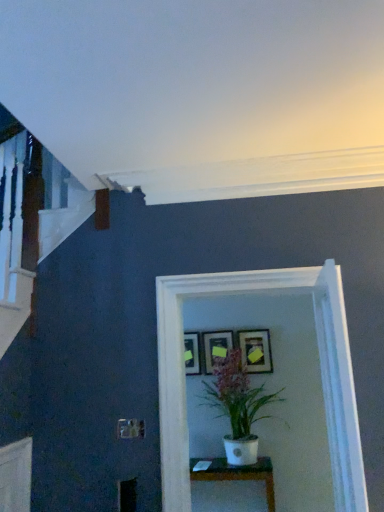
Question: Is there a large distance between white matte pot at center and matte black picture frame at center, the second picture frame when ordered from left to right?

Choices:
 (A) no
 (B) yes

Answer: (A)

Question: Can you confirm if white matte pot at center is smaller than matte black picture frame at center, the second picture frame when ordered from left to right?

Choices:
 (A) no
 (B) yes

Answer: (A)

Question: Is white matte pot at center closer to camera compared to matte black picture frame at center, which is counted as the second picture frame, starting from the right?

Choices:
 (A) yes
 (B) no

Answer: (A)

Question: Does white matte pot at center have a larger size compared to matte black picture frame at center, which is counted as the second picture frame, starting from the right?

Choices:
 (A) no
 (B) yes

Answer: (B)

Question: Are white matte pot at center and matte black picture frame at center, which is counted as the second picture frame, starting from the right, making contact?

Choices:
 (A) yes
 (B) no

Answer: (B)

Question: Is white matte pot at center located outside matte black picture frame at center, which is counted as the second picture frame, starting from the right?

Choices:
 (A) no
 (B) yes

Answer: (B)

Question: From a real-world perspective, is matte black picture frame at center, the second picture frame when ordered from left to right, located beneath matte black picture frame at center, placed as the 3th picture frame when sorted from right to left?

Choices:
 (A) yes
 (B) no

Answer: (B)

Question: Is matte black picture frame at center, the second picture frame when ordered from left to right, far away from matte black picture frame at center, placed as the 3th picture frame when sorted from right to left?

Choices:
 (A) yes
 (B) no

Answer: (B)

Question: Is matte black picture frame at center, which is counted as the second picture frame, starting from the right, in contact with matte black picture frame at center, the 1th picture frame viewed from the left?

Choices:
 (A) yes
 (B) no

Answer: (B)

Question: Considering the relative positions of matte black picture frame at center, which is counted as the second picture frame, starting from the right, and matte black picture frame at center, the 1th picture frame viewed from the left, in the image provided, is matte black picture frame at center, which is counted as the second picture frame, starting from the right, in front of matte black picture frame at center, the 1th picture frame viewed from the left,?

Choices:
 (A) no
 (B) yes

Answer: (B)

Question: Is matte black picture frame at center, which is counted as the second picture frame, starting from the right, smaller than matte black picture frame at center, the 1th picture frame viewed from the left?

Choices:
 (A) yes
 (B) no

Answer: (B)

Question: Considering the relative sizes of matte black picture frame at center, which is counted as the second picture frame, starting from the right, and matte black picture frame at center, the 1th picture frame viewed from the left, in the image provided, is matte black picture frame at center, which is counted as the second picture frame, starting from the right, thinner than matte black picture frame at center, the 1th picture frame viewed from the left,?

Choices:
 (A) no
 (B) yes

Answer: (A)

Question: Does white glossy glass door at center have a larger size compared to matte gold picture frame at center, which is counted as the first picture frame, starting from the right?

Choices:
 (A) no
 (B) yes

Answer: (B)